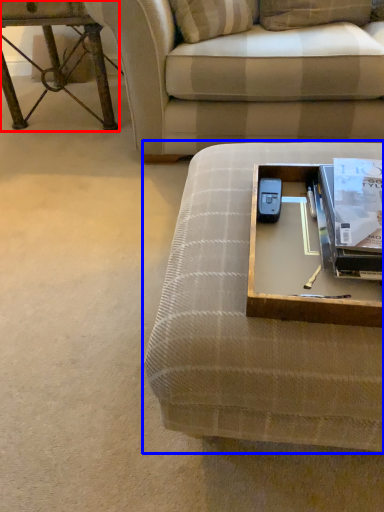
Question: Which object is closer to the camera taking this photo, table (highlighted by a red box) or studio couch (highlighted by a blue box)?

Choices:
 (A) table
 (B) studio couch

Answer: (B)